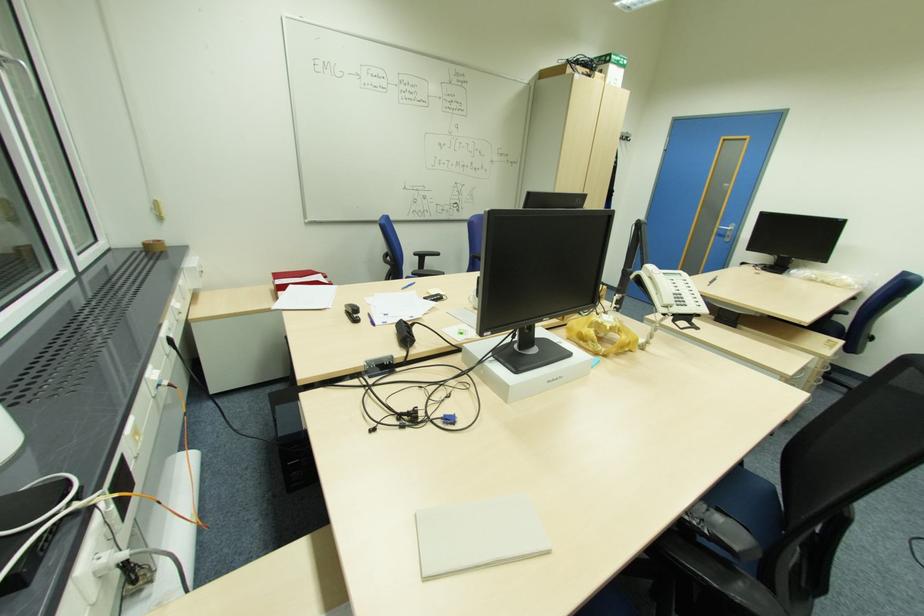
This screenshot has width=924, height=616. Describe the element at coordinates (659, 288) in the screenshot. I see `the telephone handset` at that location.